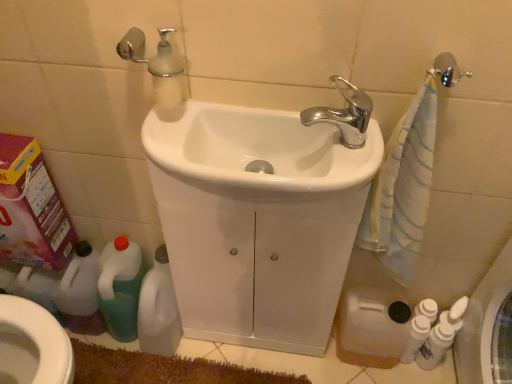
Find the location of a particular element. free spot in front of white glossy sink at center, arranged as the 2th sink when viewed from the front is located at coordinates (253, 366).